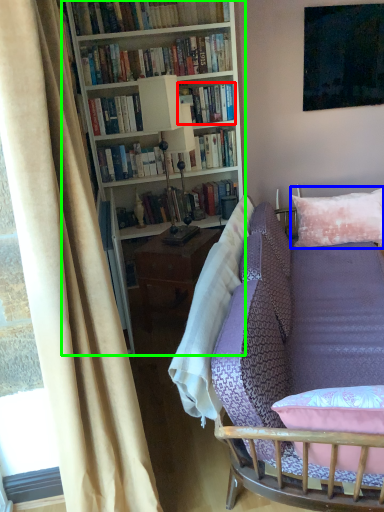
Question: Estimate the real-world distances between objects in this image. Which object is closer to book (highlighted by a red box), pillow (highlighted by a blue box) or bookcase (highlighted by a green box)?

Choices:
 (A) pillow
 (B) bookcase

Answer: (B)